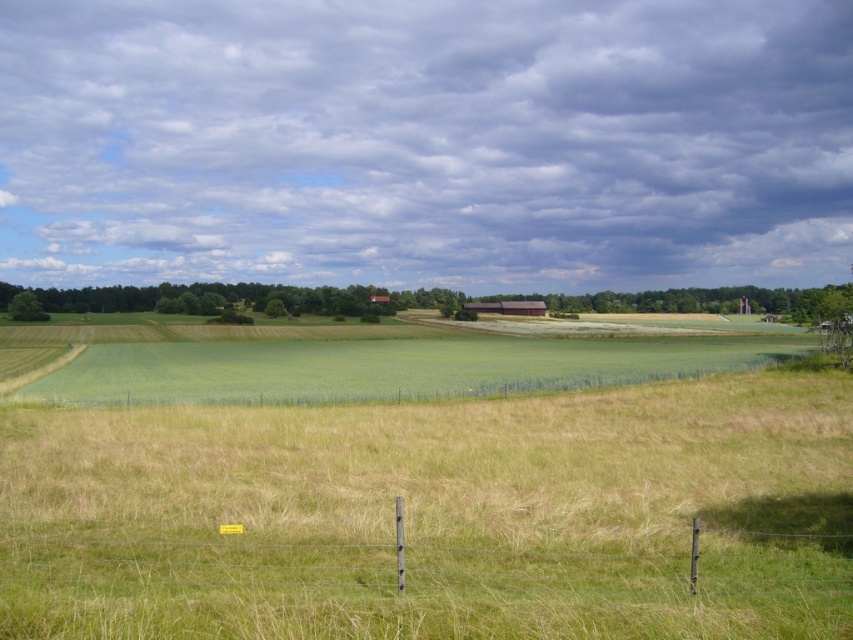
Question: Among these points, which one is nearest to the camera?

Choices:
 (A) (227, 566)
 (B) (566, 371)

Answer: (A)

Question: Which of these objects is positioned farthest from the green grassy fence at lower center?

Choices:
 (A) green grassy wheat field at center
 (B) green grassy field at center

Answer: (B)

Question: Which of the following is the farthest from the observer?

Choices:
 (A) green grassy fence at lower center
 (B) green grassy field at center
 (C) green grassy wheat field at center

Answer: (B)

Question: Can you confirm if green grassy fence at lower center is smaller than green grassy field at center?

Choices:
 (A) yes
 (B) no

Answer: (A)

Question: Can you confirm if green grassy fence at lower center is smaller than green grassy field at center?

Choices:
 (A) no
 (B) yes

Answer: (B)

Question: Does green grassy wheat field at center have a greater width compared to green grassy fence at lower center?

Choices:
 (A) no
 (B) yes

Answer: (B)